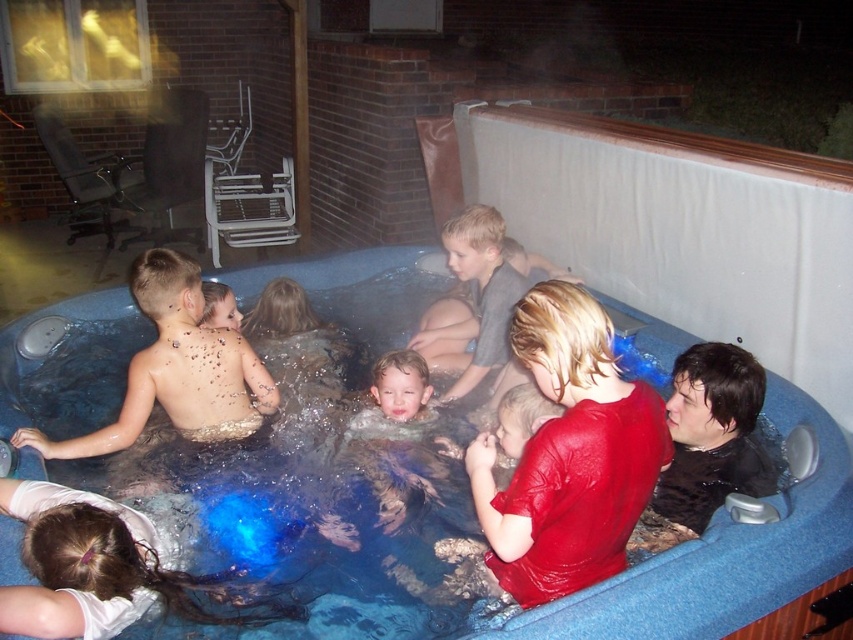
You are a photographer positioned to the right of the hot tub. You want to take a photo that includes both the smooth tan skin at left and the gray cotton shirt at center. Which object should you adjust your camera angle to focus on first to ensure both are in frame?

The smooth tan skin at left is to the left of the gray cotton shirt at center, so you should first focus on the smooth tan skin at left to ensure both are captured in the frame.

You are a photographer taking a nighttime photo of the hot tub scene. You want to ensure both the white matte hair at lower left and the smooth skin child at center are clearly visible in your shot. Based on their positions, which object should you focus on first to ensure both are in focus?

Since the white matte hair at lower left is to the left of the smooth skin child at center, you should focus on the smooth skin child at center first as it is closer to the center of the image, making it easier to ensure both are in focus.

Based on the scene description, can you determine if the white matte hair at lower left is wider than the smooth skin child at center?

The white matte hair at lower left is wider than the smooth skin child at center according to the description.